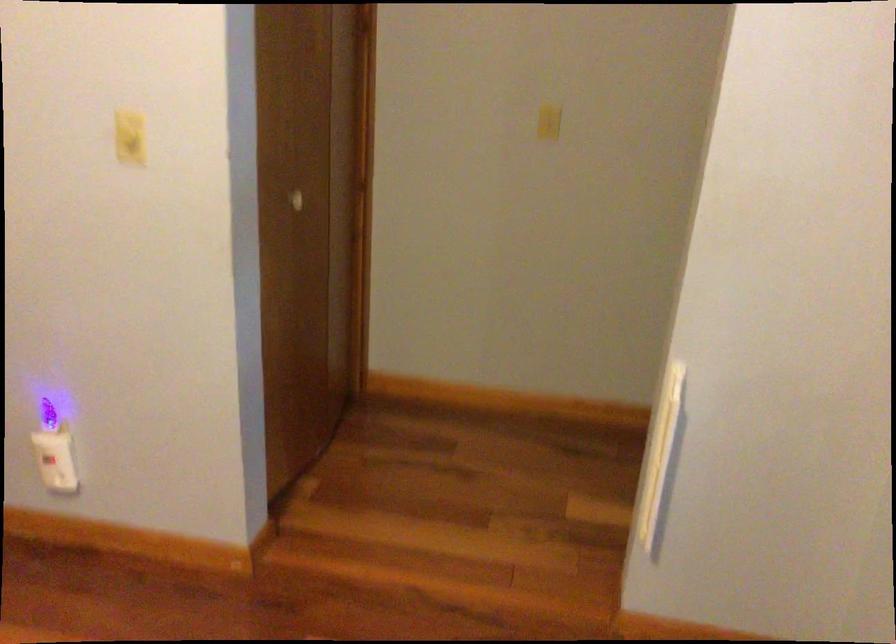
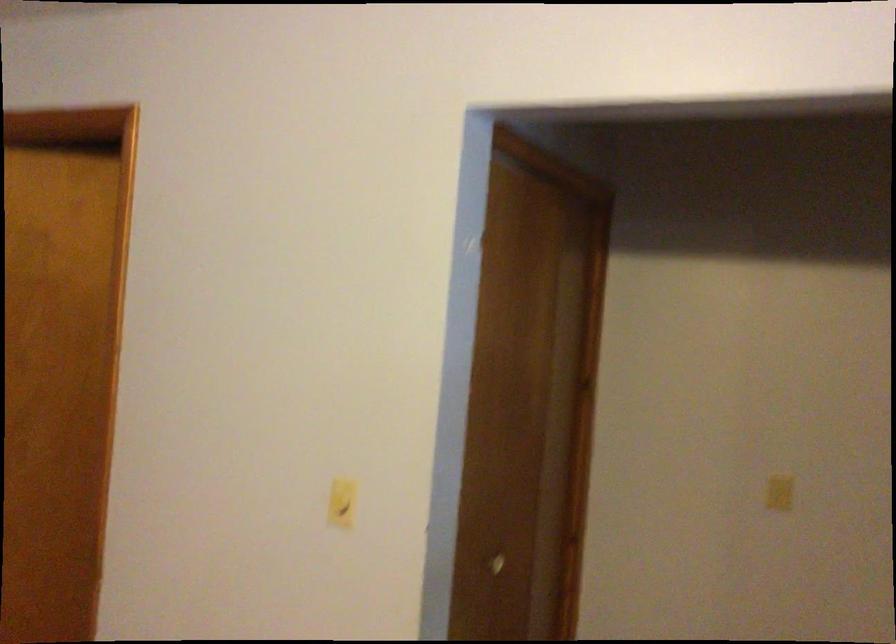
Which direction would the cameraman need to move to produce the second image?

The cameraman moved toward left, forward.